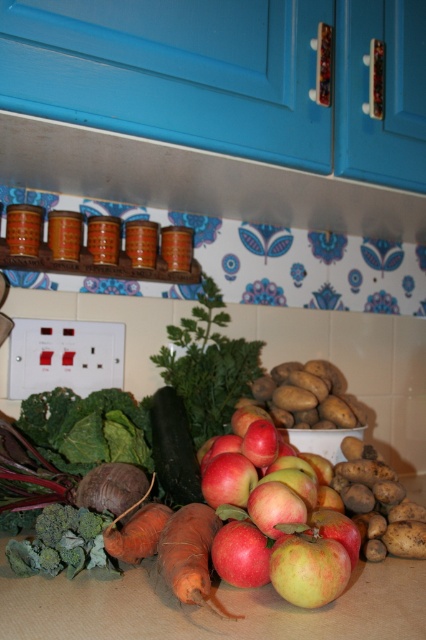
Between red matte apples at center and yellow-green matte apple at center, which one is positioned lower?

Positioned lower is yellow-green matte apple at center.

Is red matte apples at center positioned before yellow-green matte apple at center?

Yes.

Locate an element on the screen. This screenshot has height=640, width=426. red matte apples at center is located at coordinates (276, 522).

Can you confirm if red matte apples at center is thinner than green matte cucumber at center?

In fact, red matte apples at center might be wider than green matte cucumber at center.

Between red matte apples at center and green matte cucumber at center, which one is positioned higher?

Positioned higher is green matte cucumber at center.

At what (x,y) coordinates should I click in order to perform the action: click on red matte apples at center. Please return your answer as a coordinate pair (x, y). This screenshot has width=426, height=640. Looking at the image, I should click on (276, 522).

Can you confirm if yellow-green matte apple at center is positioned above green matte cucumber at center?

No, yellow-green matte apple at center is not above green matte cucumber at center.

This screenshot has width=426, height=640. What do you see at coordinates (307, 564) in the screenshot?
I see `yellow-green matte apple at center` at bounding box center [307, 564].

At what (x,y) coordinates should I click in order to perform the action: click on yellow-green matte apple at center. Please return your answer as a coordinate pair (x, y). Looking at the image, I should click on (307, 564).